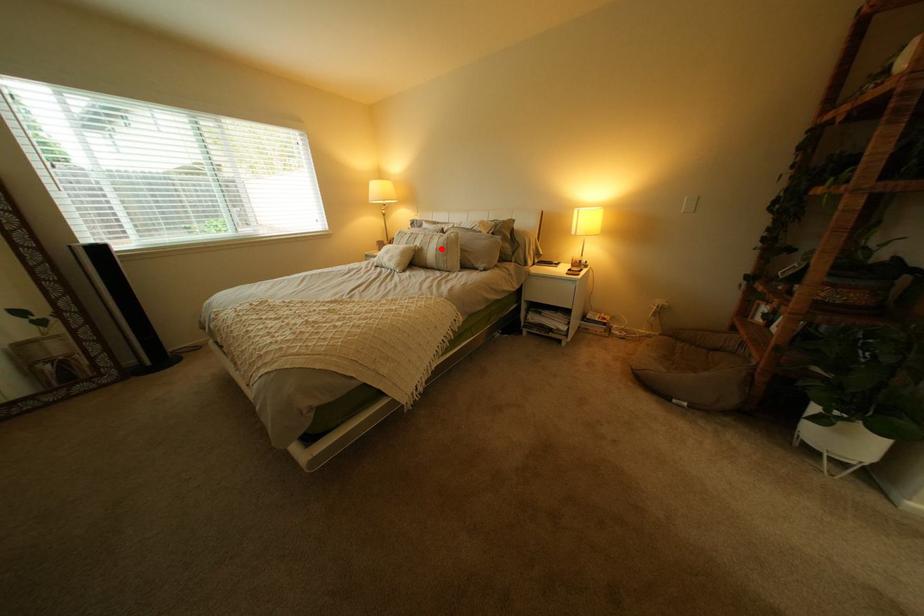
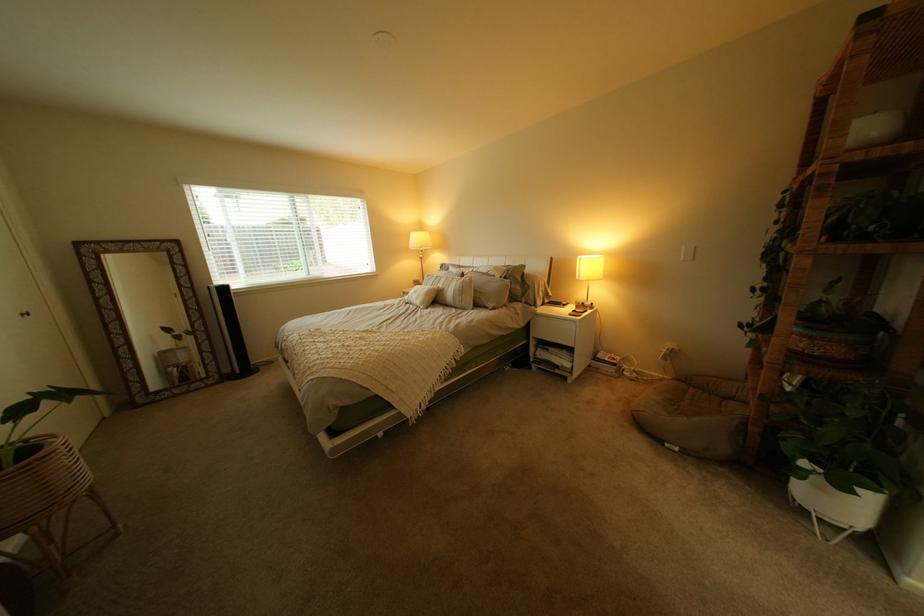
Question: I am providing you with two images of the same scene from different viewpoints. A red point is shown in image1. For the corresponding object point in image2, is it positioned nearer or farther from the camera?

Choices:
 (A) Nearer
 (B) Farther

Answer: (B)